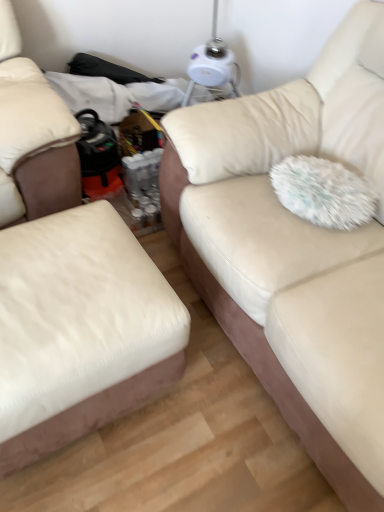
Question: From the image's perspective, would you say white leather ottoman at left, acting as the first studio couch starting from the left, is positioned over beige fabric couch at center, marked as the second studio couch in a left-to-right arrangement?

Choices:
 (A) no
 (B) yes

Answer: (A)

Question: Considering the relative sizes of white leather ottoman at left, acting as the first studio couch starting from the left, and beige fabric couch at center, placed as the 1th studio couch when sorted from right to left, in the image provided, is white leather ottoman at left, acting as the first studio couch starting from the left, smaller than beige fabric couch at center, placed as the 1th studio couch when sorted from right to left,?

Choices:
 (A) yes
 (B) no

Answer: (A)

Question: Is white leather ottoman at left, marked as the second studio couch in a right-to-left arrangement, directly adjacent to beige fabric couch at center, marked as the second studio couch in a left-to-right arrangement?

Choices:
 (A) no
 (B) yes

Answer: (A)

Question: Can you confirm if white leather ottoman at left, marked as the second studio couch in a right-to-left arrangement, is taller than beige fabric couch at center, marked as the second studio couch in a left-to-right arrangement?

Choices:
 (A) no
 (B) yes

Answer: (A)

Question: From a real-world perspective, is white leather ottoman at left, acting as the first studio couch starting from the left, under beige fabric couch at center, placed as the 1th studio couch when sorted from right to left?

Choices:
 (A) no
 (B) yes

Answer: (B)

Question: Could you tell me if white leather ottoman at left, acting as the first studio couch starting from the left, is turned towards beige fabric couch at center, marked as the second studio couch in a left-to-right arrangement?

Choices:
 (A) no
 (B) yes

Answer: (A)

Question: Considering the relative sizes of beige fabric couch at center, placed as the 1th studio couch when sorted from right to left, and white plastic table lamp at upper center in the image provided, is beige fabric couch at center, placed as the 1th studio couch when sorted from right to left, smaller than white plastic table lamp at upper center?

Choices:
 (A) no
 (B) yes

Answer: (A)

Question: Is beige fabric couch at center, marked as the second studio couch in a left-to-right arrangement, at the left side of white plastic table lamp at upper center?

Choices:
 (A) no
 (B) yes

Answer: (A)

Question: From the image's perspective, is beige fabric couch at center, placed as the 1th studio couch when sorted from right to left, on top of white plastic table lamp at upper center?

Choices:
 (A) yes
 (B) no

Answer: (B)

Question: Can you confirm if beige fabric couch at center, placed as the 1th studio couch when sorted from right to left, is taller than white plastic table lamp at upper center?

Choices:
 (A) no
 (B) yes

Answer: (B)

Question: From the image's perspective, is beige fabric couch at center, placed as the 1th studio couch when sorted from right to left, located beneath white plastic table lamp at upper center?

Choices:
 (A) yes
 (B) no

Answer: (A)

Question: Does white plastic table lamp at upper center turn towards white leather ottoman at left, acting as the first studio couch starting from the left?

Choices:
 (A) no
 (B) yes

Answer: (A)